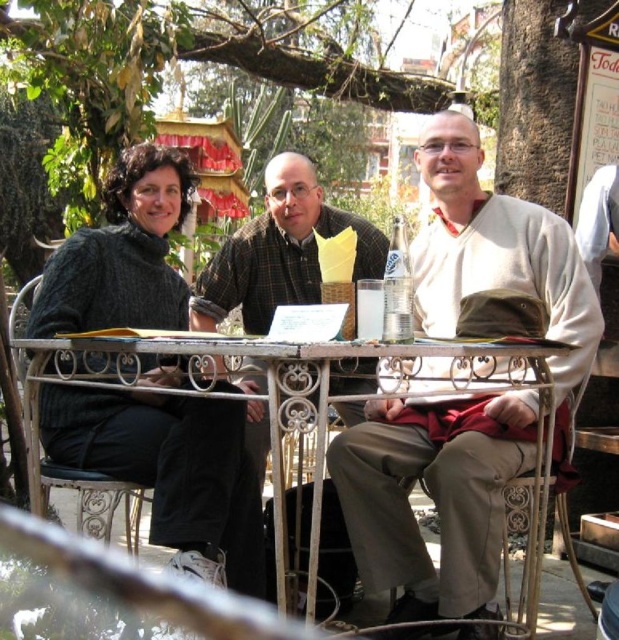
Question: Which of these objects is positioned closest to the white wrought iron table at center?

Choices:
 (A) dark gray knitted sweater at left
 (B) matte beige sweater at center

Answer: (A)

Question: Which of the following is the farthest from the observer?

Choices:
 (A) dark gray knitted sweater at left
 (B) matte beige sweater at center

Answer: (A)

Question: Considering the relative positions of dark gray knitted sweater at left and white wrought iron table at center in the image provided, where is dark gray knitted sweater at left located with respect to white wrought iron table at center?

Choices:
 (A) right
 (B) left

Answer: (B)

Question: Which object is farther from the camera taking this photo?

Choices:
 (A) white wrought iron table at center
 (B) dark gray knitted sweater at left

Answer: (B)

Question: Observing the image, what is the correct spatial positioning of matte beige sweater at center in reference to dark gray knitted sweater at left?

Choices:
 (A) above
 (B) below

Answer: (A)

Question: Considering the relative positions of matte beige sweater at center and white wrought iron table at center in the image provided, where is matte beige sweater at center located with respect to white wrought iron table at center?

Choices:
 (A) left
 (B) right

Answer: (B)